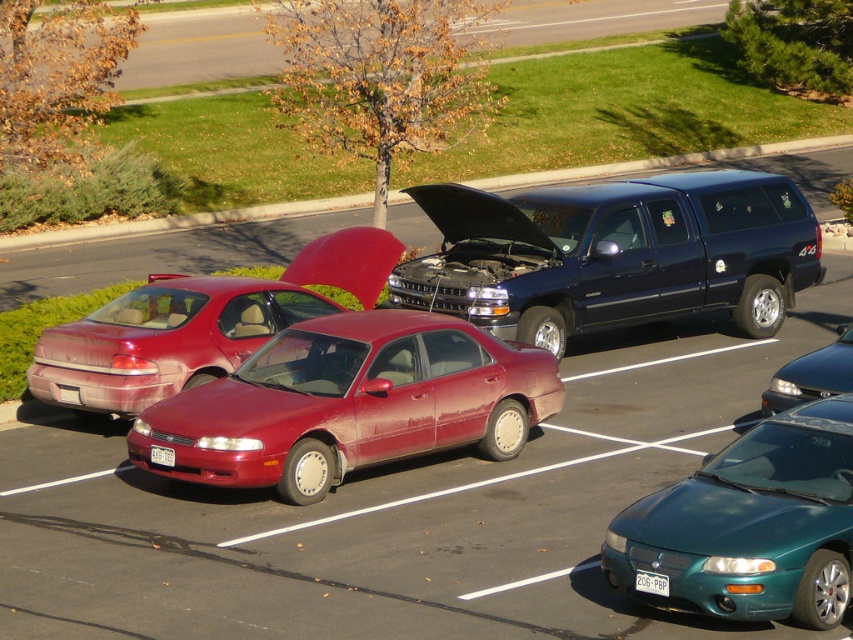
Who is taller, dull red sedan at center or rusty matte sedan at center?

dull red sedan at center is taller.

Identify the location of dull red sedan at center. The height and width of the screenshot is (640, 853). (351, 403).

Which of these two, rusty matte sedan at center or metallic gray sedan at lower right, stands shorter?

metallic gray sedan at lower right is shorter.

Does rusty matte sedan at center have a greater width compared to metallic gray sedan at lower right?

Yes.

Does point (274, 307) come in front of point (834, 369)?

No.

Identify the location of rusty matte sedan at center. Image resolution: width=853 pixels, height=640 pixels. (163, 339).

Between point (780, 387) and point (634, 580), which one is positioned behind?

Positioned behind is point (780, 387).

Is metallic gray sedan at lower right above white plastic license plate at center?

Correct, metallic gray sedan at lower right is located above white plastic license plate at center.

Image resolution: width=853 pixels, height=640 pixels. I want to click on metallic gray sedan at lower right, so click(x=811, y=376).

The image size is (853, 640). Identify the location of metallic gray sedan at lower right. (811, 376).